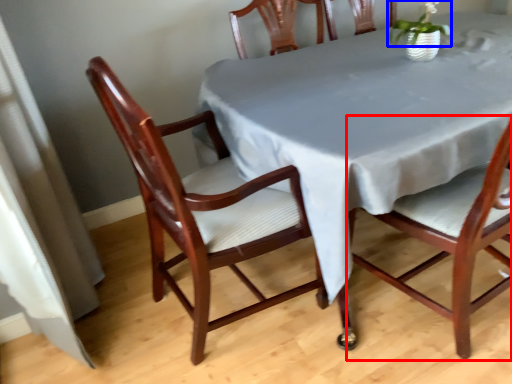
Question: Which of the following is the closest to the observer, chair (highlighted by a red box) or plant (highlighted by a blue box)?

Choices:
 (A) chair
 (B) plant

Answer: (A)